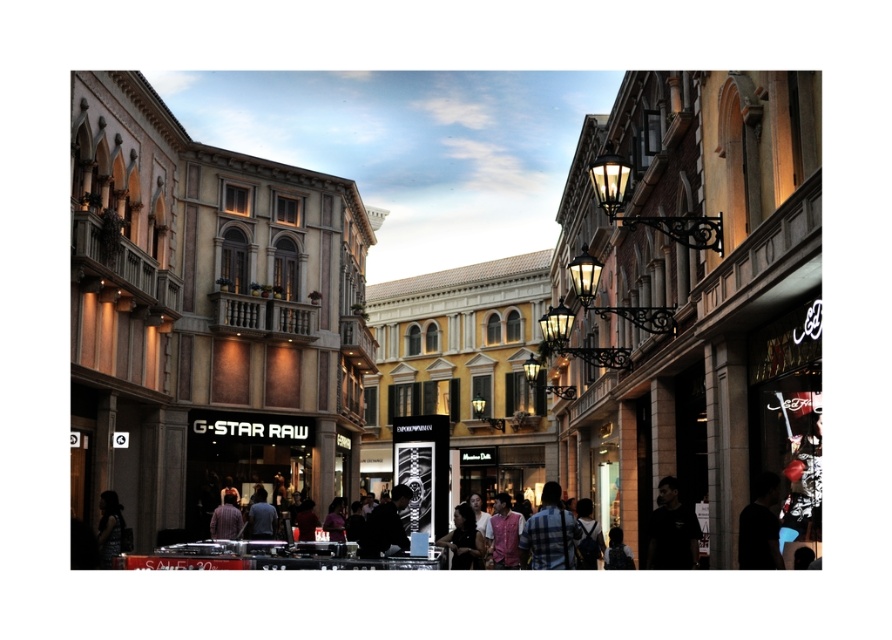
You are a customer in this shopping district and you want to buy a shirt. You see the black matte shirt at lower right and the striped fabric shirt at center. Which one is larger in size?

The black matte shirt at lower right is bigger than the striped fabric shirt at center.

You are a delivery person who needs to place a package between the plaid shirt at center and the blue fabric shirt at center. The package is 30 meters long. Will it fit between them?

The distance between the plaid shirt at center and the blue fabric shirt at center is 29.87 meters. Since the package is 30 meters long, it will not fit between them as it is slightly longer than the available space.

You are a delivery person standing at the entrance of the G_STAR RAW store. You need to place a package at the black matte shirt at lower right and then another package at the striped fabric shirt at center. Given that your delivery cart can only carry packages for a total distance of 120 feet before needing to recharge, can you complete both deliveries without recharging?

The distance between the black matte shirt at lower right and the striped fabric shirt at center is 118.28 feet. Since the total distance required for both deliveries is 118.28 feet, which is under the 120 feet limit, you can complete both deliveries without needing to recharge.